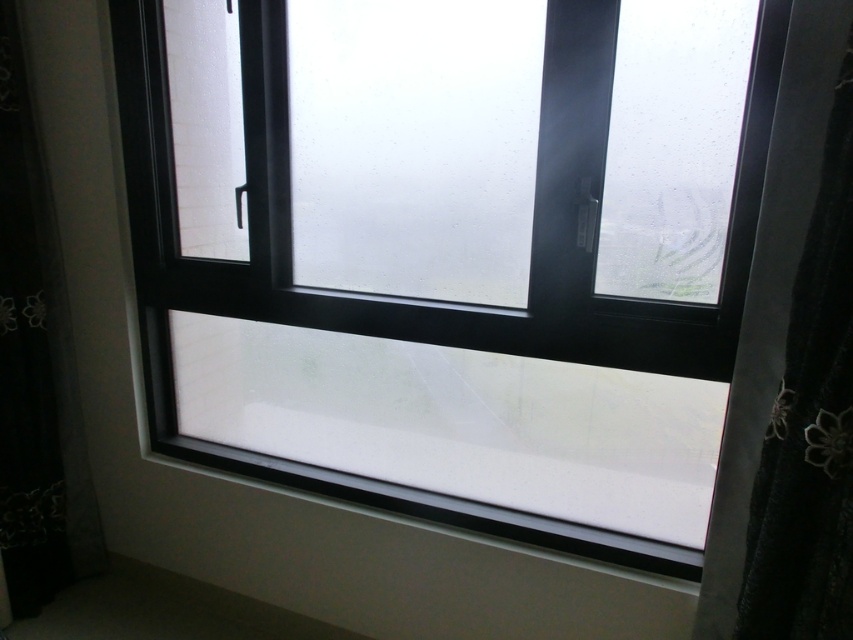
Question: Does black textured curtain at right have a greater width compared to black lace curtain at left?

Choices:
 (A) yes
 (B) no

Answer: (B)

Question: Is transparent glass window at center positioned behind black textured curtain at right?

Choices:
 (A) yes
 (B) no

Answer: (A)

Question: Estimate the real-world distances between objects in this image. Which object is closer to the transparent glass window at center?

Choices:
 (A) black textured curtain at right
 (B) white smooth window sill at center

Answer: (B)

Question: Which point is farther to the camera?

Choices:
 (A) pyautogui.click(x=41, y=355)
 (B) pyautogui.click(x=805, y=584)
 (C) pyautogui.click(x=439, y=499)

Answer: (A)

Question: Does transparent glass window at center appear on the left side of black textured curtain at right?

Choices:
 (A) yes
 (B) no

Answer: (A)

Question: Which of these objects is positioned closest to the black textured curtain at right?

Choices:
 (A) transparent glass window at center
 (B) white smooth window sill at center

Answer: (B)